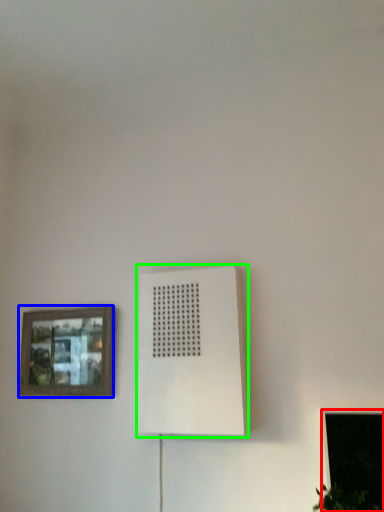
Question: Which object is the closest to the window (highlighted by a red box)? Choose among these: picture frame (highlighted by a blue box) or air conditioning (highlighted by a green box).

Choices:
 (A) picture frame
 (B) air conditioning

Answer: (B)